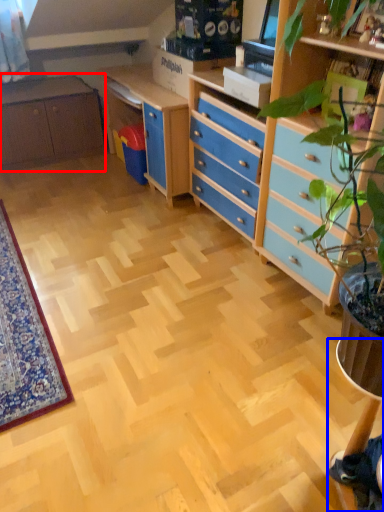
Question: Which of the following is the closest to the observer, cabinetry (highlighted by a red box) or computer desk (highlighted by a blue box)?

Choices:
 (A) cabinetry
 (B) computer desk

Answer: (B)